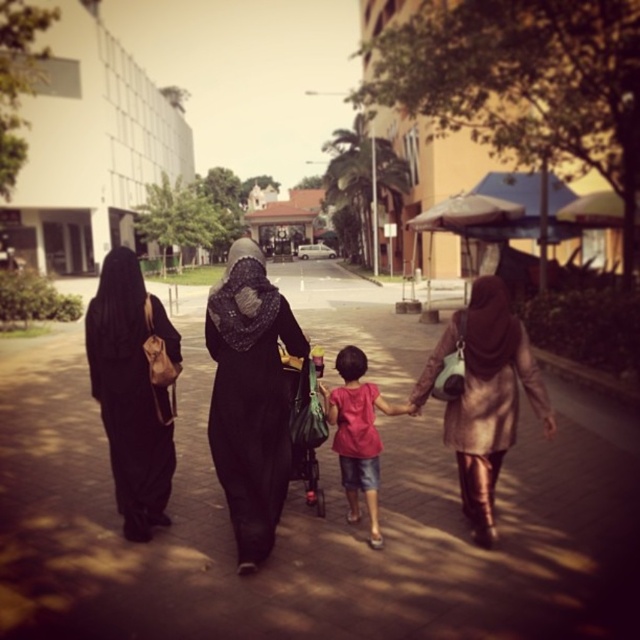
Is black matte hijab at center to the right of pink fabric shirt at center from the viewer's perspective?

Incorrect, black matte hijab at center is not on the right side of pink fabric shirt at center.

Where is `black matte hijab at center`? black matte hijab at center is located at coordinates (250, 397).

Does brown leather coat at center have a greater width compared to pink fabric shirt at center?

Yes, brown leather coat at center is wider than pink fabric shirt at center.

Between point (481, 353) and point (362, 397), which one is positioned behind?

Positioned behind is point (362, 397).

At what (x,y) coordinates should I click in order to perform the action: click on brown leather coat at center. Please return your answer as a coordinate pair (x, y). Looking at the image, I should click on (484, 396).

Can you confirm if black matte hijab at left is taller than pink fabric shirt at center?

Correct, black matte hijab at left is much taller as pink fabric shirt at center.

Is black matte hijab at left to the right of pink fabric shirt at center from the viewer's perspective?

In fact, black matte hijab at left is to the left of pink fabric shirt at center.

Is point (102, 337) closer to camera compared to point (372, 536)?

No.

The image size is (640, 640). I want to click on black matte hijab at left, so click(134, 388).